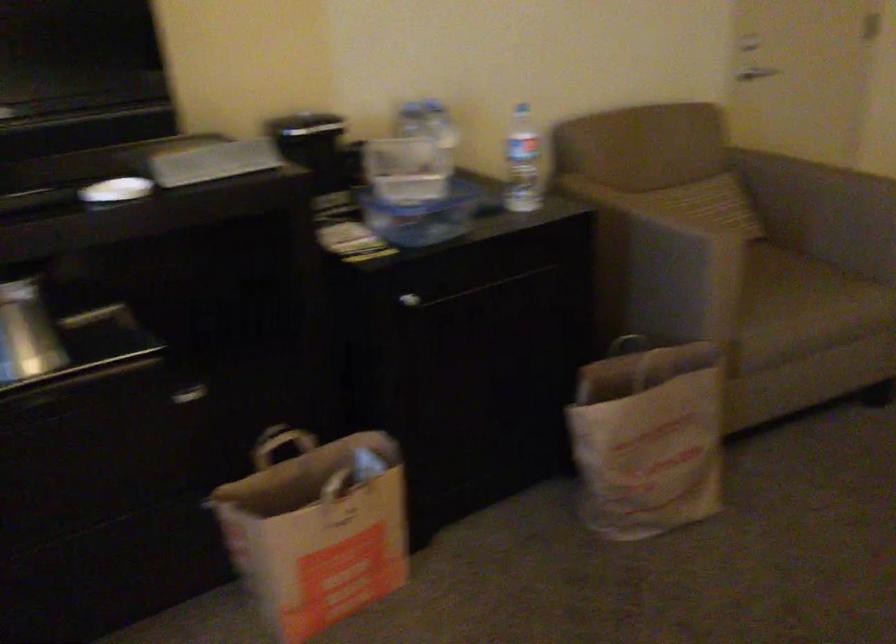
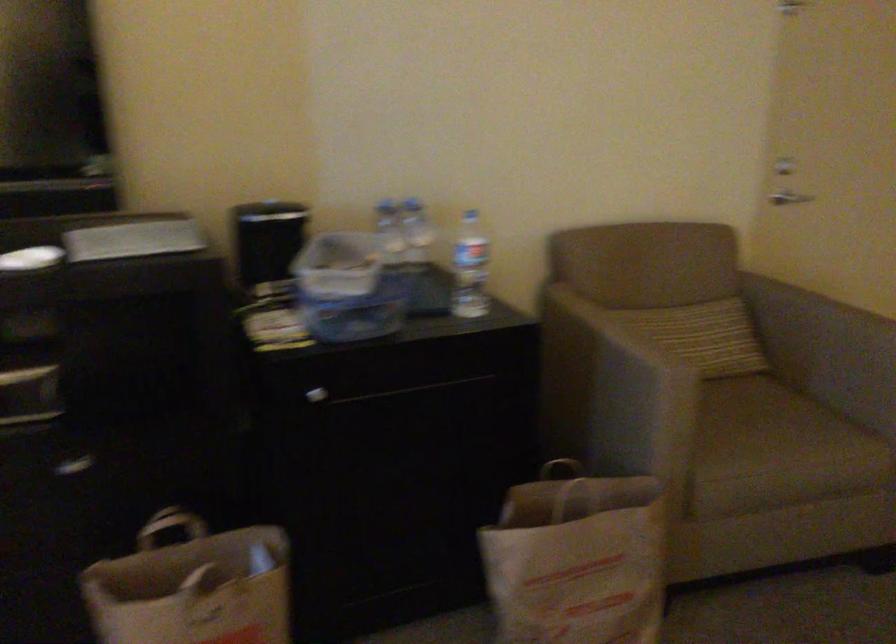
Where in the second image is the point corresponding to point (522, 162) from the first image?

(470, 268)